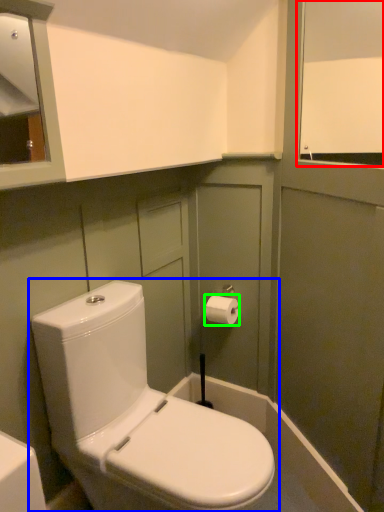
Question: Based on their relative distances, which object is farther from window screen (highlighted by a red box)? Choose from toilet (highlighted by a blue box) and toiletry (highlighted by a green box).

Choices:
 (A) toilet
 (B) toiletry

Answer: (A)